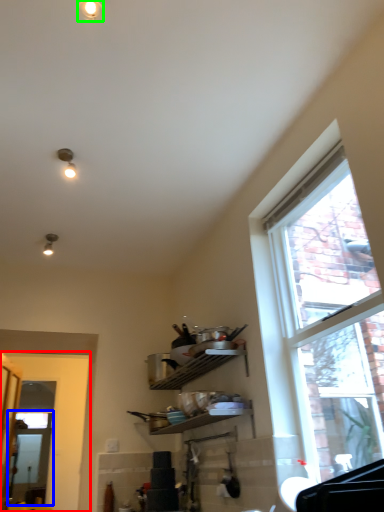
Question: Which object is the farthest from door (highlighted by a red box)? Choose among these: screen door (highlighted by a blue box) or light fixture (highlighted by a green box).

Choices:
 (A) screen door
 (B) light fixture

Answer: (B)